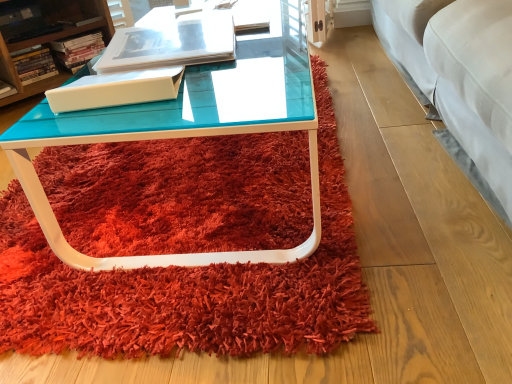
Question: Considering the positions of matte white book at upper left, the fourth book viewed from the front, and hardcover book at upper left, positioned as the third book in back-to-front order, in the image, is matte white book at upper left, the fourth book viewed from the front, wider or thinner than hardcover book at upper left, positioned as the third book in back-to-front order,?

Choices:
 (A) thin
 (B) wide

Answer: (B)

Question: Based on their sizes in the image, would you say matte white book at upper left, the second book when ordered from right to left, is bigger or smaller than hardcover book at upper left, positioned as the third book in back-to-front order?

Choices:
 (A) small
 (B) big

Answer: (B)

Question: Which object is positioned closest to the white plastic container at upper left?

Choices:
 (A) matte white book at upper left, the fourth book positioned from the left
 (B) matte white book at upper left, the fifth book positioned from the front
 (C) matte white book at center, which is counted as the 5th book, starting from the right
 (D) white glossy book at upper center, marked as the fifth book in a left-to-right arrangement
 (E) teal glass coffee table at center

Answer: (A)

Question: Considering the real-world distances, which object is farthest from the hardcover book at upper left, which is counted as the third book, starting from the front?

Choices:
 (A) matte white book at center, arranged as the 4th book when viewed from the back
 (B) teal glass coffee table at center
 (C) matte white book at upper left, the third book from the left
 (D) matte white book at upper left, the fourth book viewed from the front
 (E) white glossy book at upper center, the 1th book positioned from the right

Answer: (B)